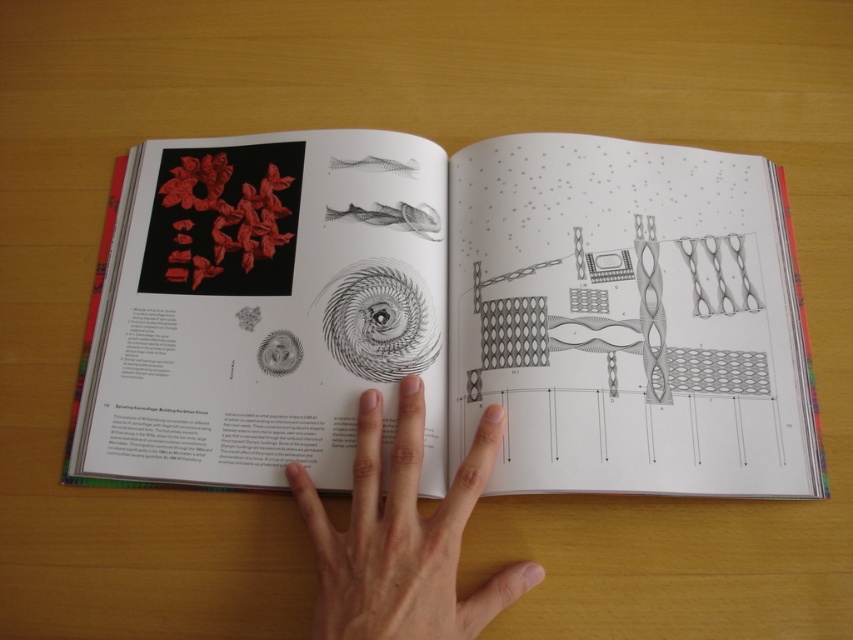
Question: Can you confirm if matte black book at center is positioned below skinny flesh at center?

Choices:
 (A) yes
 (B) no

Answer: (B)

Question: Where is matte black book at center located in relation to skinny flesh at center in the image?

Choices:
 (A) left
 (B) right

Answer: (B)

Question: Can you confirm if matte black book at center is bigger than skinny flesh at center?

Choices:
 (A) no
 (B) yes

Answer: (B)

Question: Among these objects, which one is nearest to the camera?

Choices:
 (A) skinny flesh at center
 (B) matte black book at center

Answer: (A)